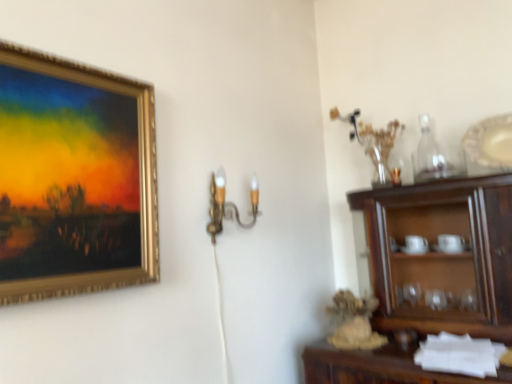
Question: Is gold metallic picture frame at upper left bigger or smaller than gold metallic wall sconce at center?

Choices:
 (A) big
 (B) small

Answer: (A)

Question: Considering their positions, is gold metallic picture frame at upper left located in front of or behind gold metallic wall sconce at center?

Choices:
 (A) front
 (B) behind

Answer: (A)

Question: Based on their relative distances, which object is farther from the clear glass bottle at upper right?

Choices:
 (A) gold metallic wall sconce at center
 (B) white wood cabinet at lower right
 (C) white glossy platter at upper right
 (D) gold metallic picture frame at upper left
 (E) dark wood cabinet at right

Answer: (D)

Question: Estimate the real-world distances between objects in this image. Which object is closer to the gold metallic picture frame at upper left?

Choices:
 (A) white glossy platter at upper right
 (B) gold metallic wall sconce at center
 (C) dark wood cabinet at right
 (D) white wood cabinet at lower right
 (E) clear glass bottle at upper right

Answer: (B)